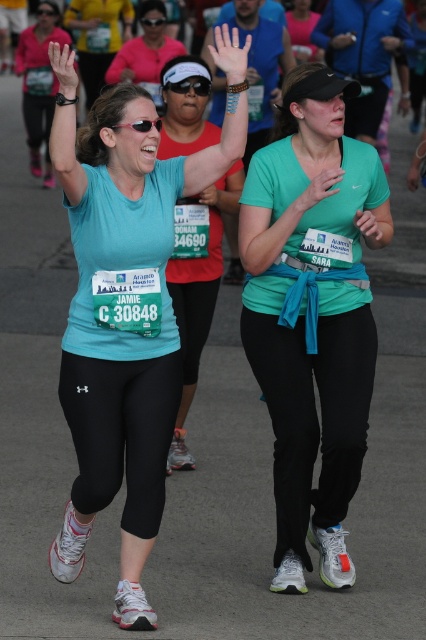
You are a photographer positioned at the starting line of the Aramco Houston Half Marathon. You want to capture a photo of both the woman on the left and the matte blue shirt at center in the same frame. Given that your camera has a 50mm lens with a field of view that can capture objects up to 5 meters apart, will you be able to include both subjects in the photo?

The two subjects are 4.35 meters apart, which is within the 5 meters field of view of the camera lens. Therefore, both the woman on the left and the matte blue shirt at center can be captured in the same frame.